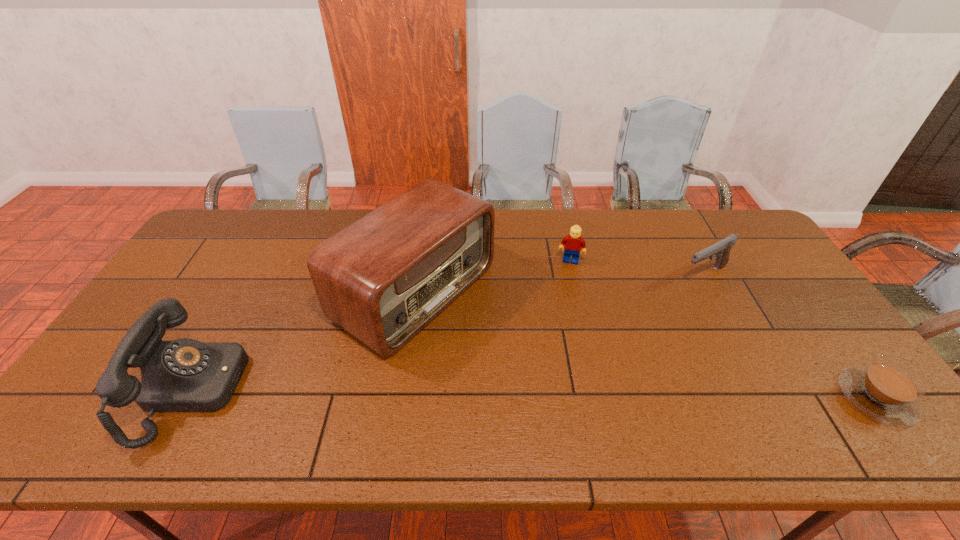
What are the coordinates of `object that is the second closest to the fourth object from left to right` in the screenshot? It's located at (887, 390).

I want to click on free spot that satisfies the following two spatial constraints: 1. on the front side of the pistol; 2. on the left side of the cappuccino, so click(772, 397).